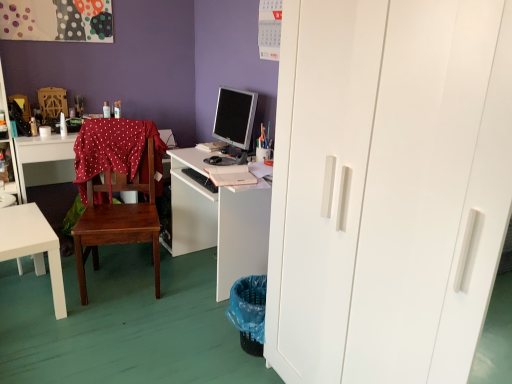
The height and width of the screenshot is (384, 512). What are the coordinates of `unoccupied region to the right of wooden chair at center` in the screenshot? It's located at (182, 296).